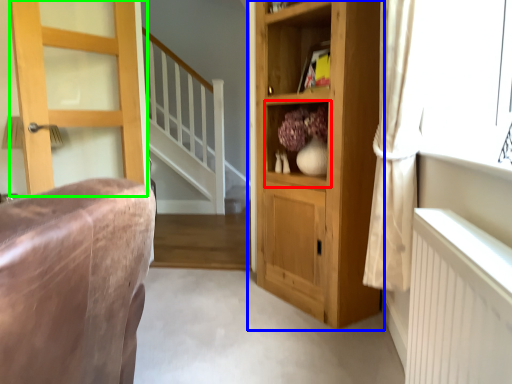
Question: Which is nearer to the cabinet (highlighted by a red box)? cupboard (highlighted by a blue box) or door (highlighted by a green box).

Choices:
 (A) cupboard
 (B) door

Answer: (A)